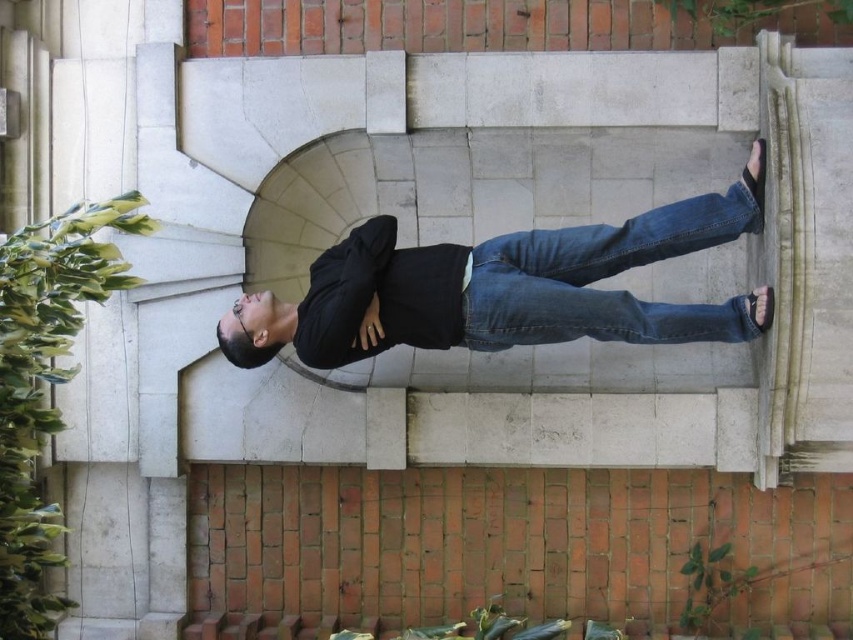
Consider the image. Is black matte shirt at center above denim at center?

Correct, black matte shirt at center is located above denim at center.

Locate an element on the screen. black matte shirt at center is located at coordinates (503, 288).

What do you see at coordinates (503, 288) in the screenshot? The width and height of the screenshot is (853, 640). I see `black matte shirt at center` at bounding box center [503, 288].

This screenshot has height=640, width=853. What are the coordinates of `black matte shirt at center` in the screenshot? It's located at (503, 288).